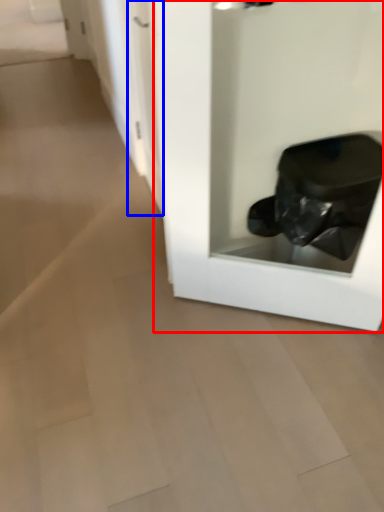
Question: Which point is further to the camera, glass door (highlighted by a red box) or door (highlighted by a blue box)?

Choices:
 (A) glass door
 (B) door

Answer: (B)